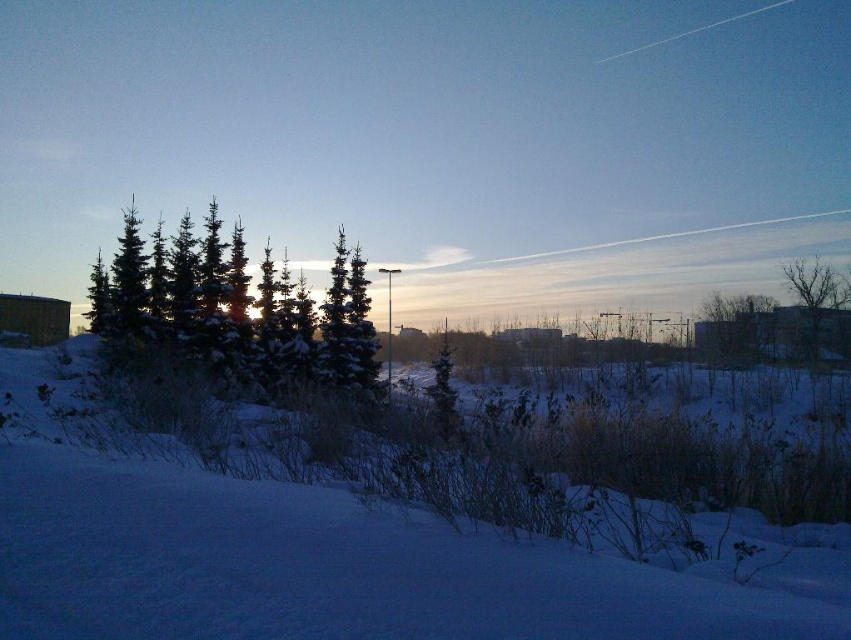
Which of these two, white fluffy snow at center or snow-covered evergreen trees at left, stands shorter?

With less height is white fluffy snow at center.

Is point (98, 470) behind point (193, 336)?

No, (98, 470) is closer to viewer.

Image resolution: width=851 pixels, height=640 pixels. What are the coordinates of `white fluffy snow at center` in the screenshot? It's located at (320, 570).

From the picture: Is white fluffy snow at center wider than snow-covered evergreen at center?

No.

Is point (658, 604) more distant than point (328, 376)?

No.

Where is `white fluffy snow at center`? The width and height of the screenshot is (851, 640). white fluffy snow at center is located at coordinates point(320,570).

Locate an element on the screen. This screenshot has height=640, width=851. white fluffy snow at center is located at coordinates (320, 570).

Is white fluffy snow at center smaller than bare branches at right?

Correct, white fluffy snow at center occupies less space than bare branches at right.

Does white fluffy snow at center have a lesser height compared to bare branches at right?

Correct, white fluffy snow at center is not as tall as bare branches at right.

Identify the location of white fluffy snow at center. (320, 570).